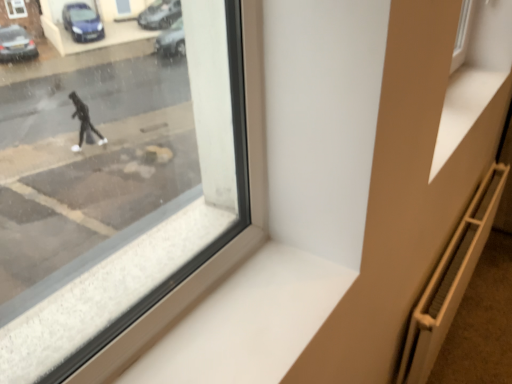
This screenshot has width=512, height=384. What are the coordinates of `free space above white smooth window sill at lower center (from a real-world perspective)` in the screenshot? It's located at (250, 315).